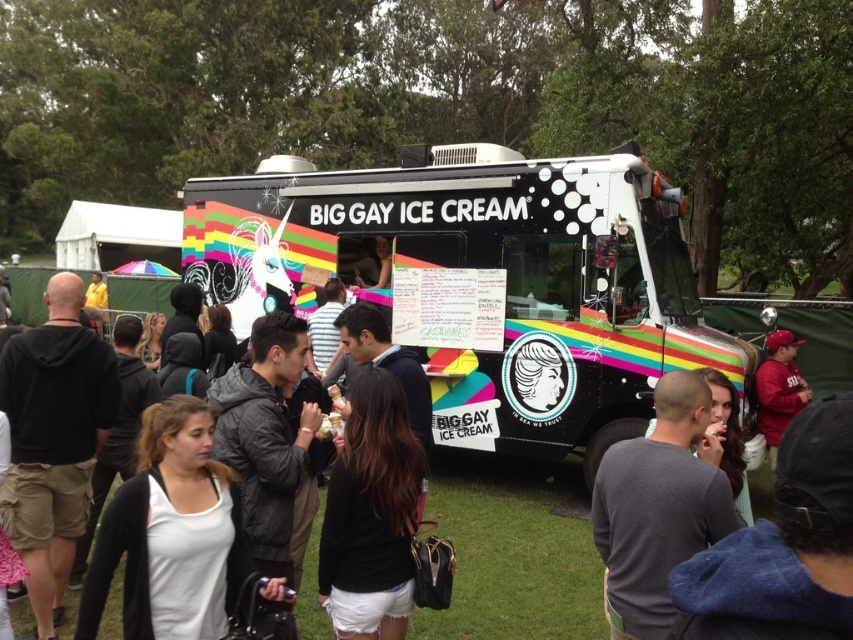
Is rainbow painted ice cream truck at center wider than matte black jacket at center?

In fact, rainbow painted ice cream truck at center might be narrower than matte black jacket at center.

Does rainbow painted ice cream truck at center appear over matte black jacket at center?

Yes.

The height and width of the screenshot is (640, 853). I want to click on rainbow painted ice cream truck at center, so click(480, 282).

This screenshot has width=853, height=640. Identify the location of rainbow painted ice cream truck at center. (480, 282).